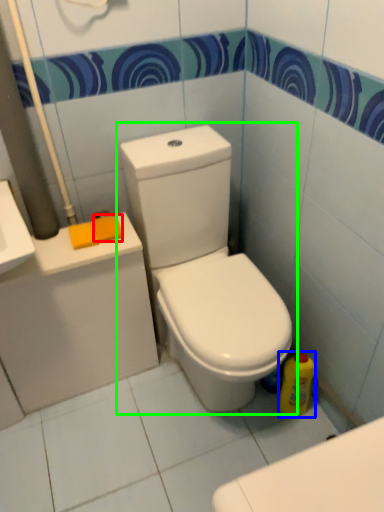
Question: Which object is positioned farthest from soap (highlighted by a red box)? Select from cleaning product (highlighted by a blue box) and toilet (highlighted by a green box).

Choices:
 (A) cleaning product
 (B) toilet

Answer: (A)